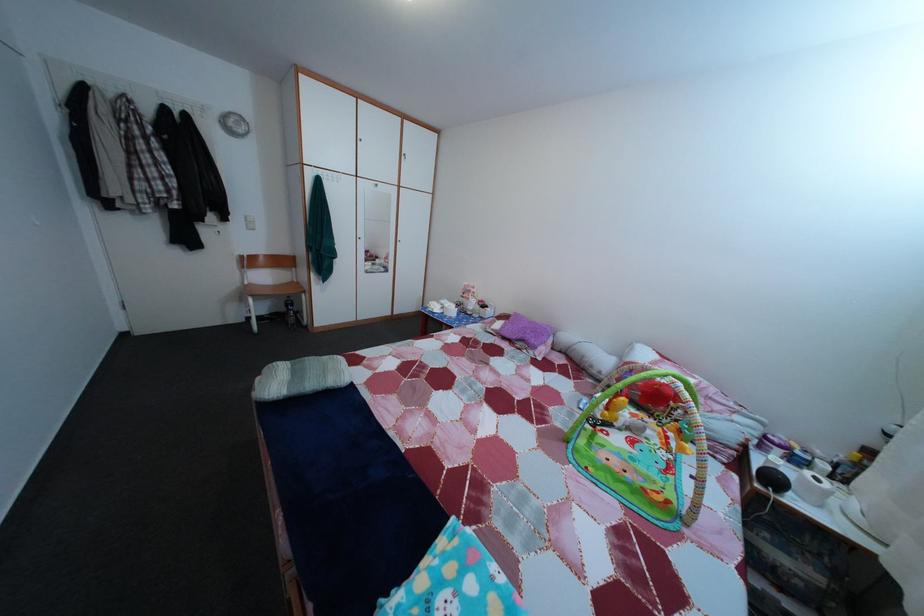
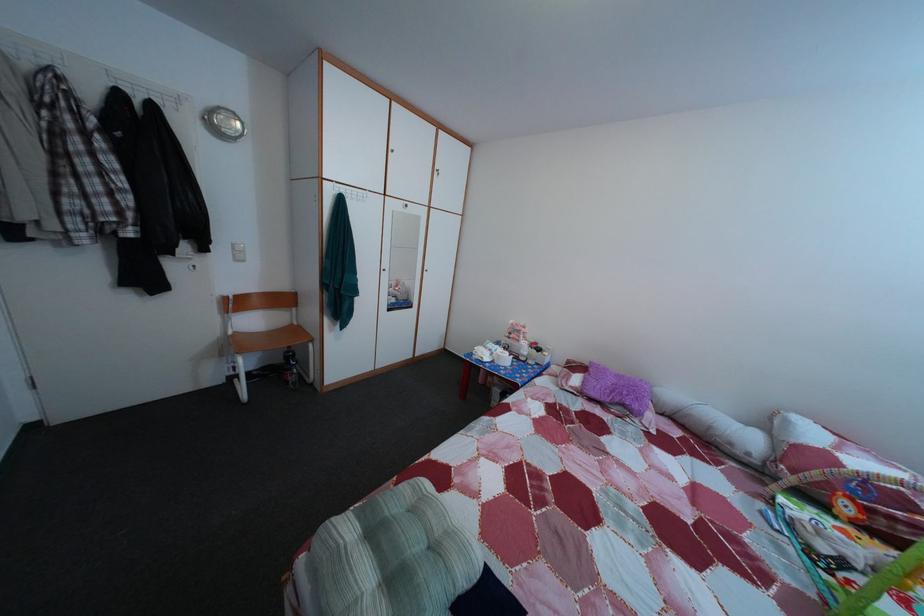
Locate, in the second image, the point that corresponds to point (478, 307) in the first image.

(528, 349)